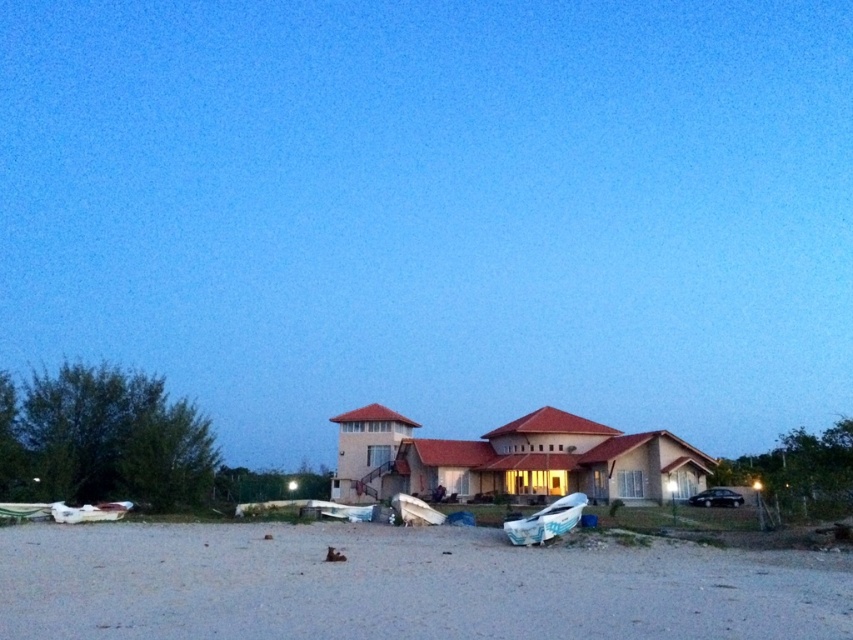
Question: Which of these objects is positioned closest to the white matte boat at center?

Choices:
 (A) white matte boat at lower left
 (B) gray gravel at lower center

Answer: (A)

Question: Can you confirm if gray gravel at lower center is wider than white matte boat at center?

Choices:
 (A) no
 (B) yes

Answer: (B)

Question: Considering the real-world distances, which object is closest to the white matte boat at lower left?

Choices:
 (A) gray gravel at lower center
 (B) white plastic boat at lower center
 (C) white matte boat at center

Answer: (C)

Question: Which point appears closest to the camera in this image?

Choices:
 (A) (396, 509)
 (B) (523, 541)
 (C) (90, 504)

Answer: (B)

Question: Does gray gravel at lower center appear over white matte boat at lower left?

Choices:
 (A) yes
 (B) no

Answer: (A)

Question: Can you confirm if gray gravel at lower center is positioned above white matte boat at center?

Choices:
 (A) no
 (B) yes

Answer: (B)